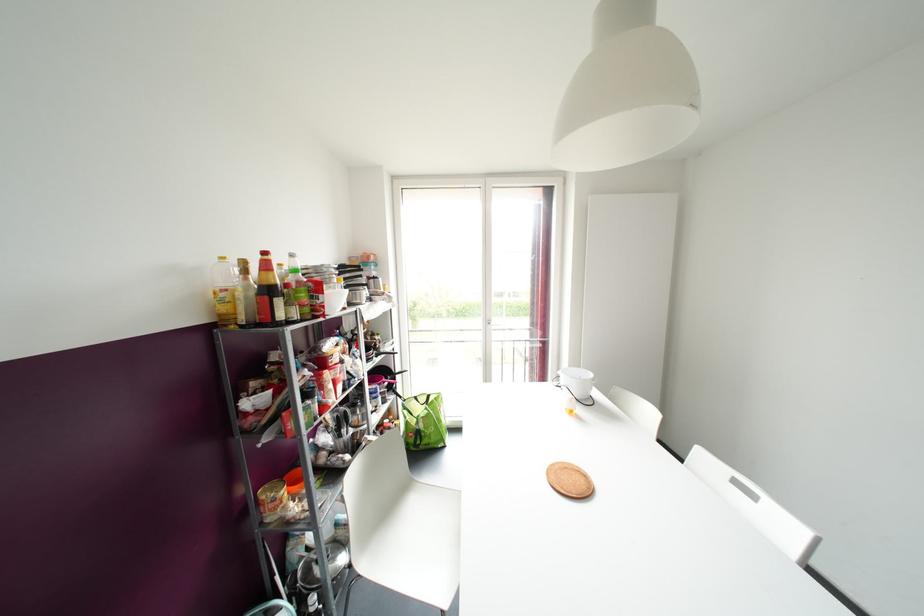
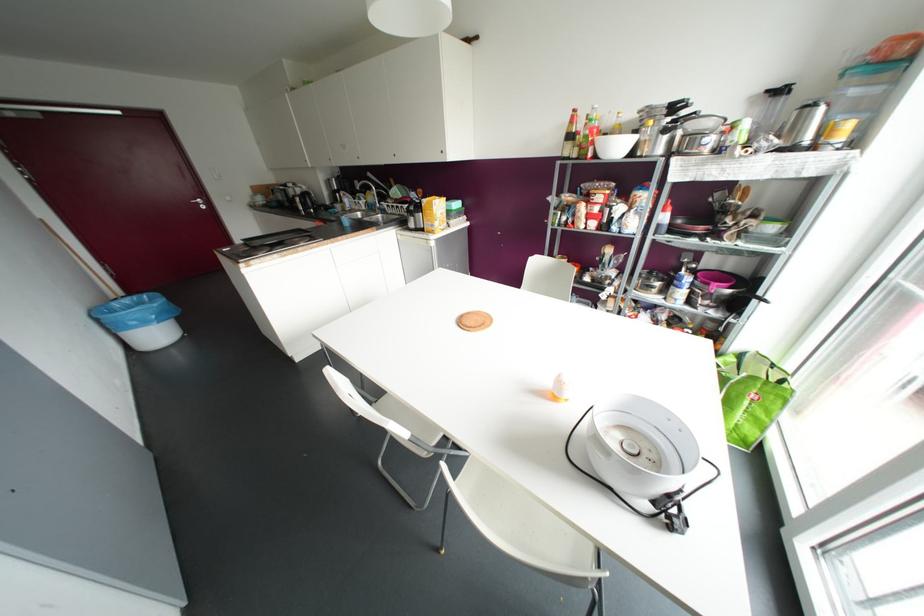
In the second image, find the point that corresponds to (264,253) in the first image.

(574, 110)